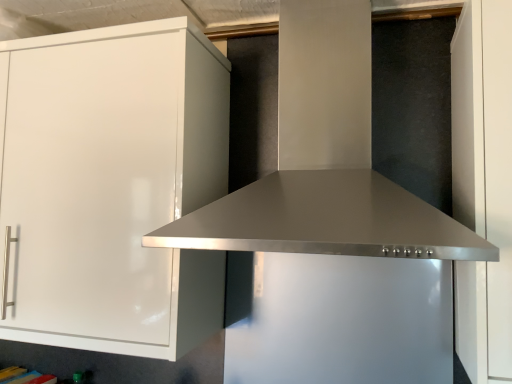
Question: In the image, is stainless steel vent at center positioned in front of or behind white glossy cabinet at left?

Choices:
 (A) front
 (B) behind

Answer: (A)

Question: Is stainless steel vent at center inside the boundaries of white glossy cabinet at left, or outside?

Choices:
 (A) outside
 (B) inside

Answer: (A)

Question: From their relative heights in the image, would you say stainless steel vent at center is taller or shorter than white glossy cabinet at left?

Choices:
 (A) short
 (B) tall

Answer: (A)

Question: Looking at their shapes, would you say white glossy cabinet at left is wider or thinner than stainless steel vent at center?

Choices:
 (A) thin
 (B) wide

Answer: (A)

Question: From the image's perspective, is white glossy cabinet at left above or below stainless steel vent at center?

Choices:
 (A) below
 (B) above

Answer: (A)

Question: Would you say white glossy cabinet at left is to the left or to the right of stainless steel vent at center in the picture?

Choices:
 (A) left
 (B) right

Answer: (A)

Question: Is white glossy cabinet at left situated inside stainless steel vent at center or outside?

Choices:
 (A) outside
 (B) inside

Answer: (A)